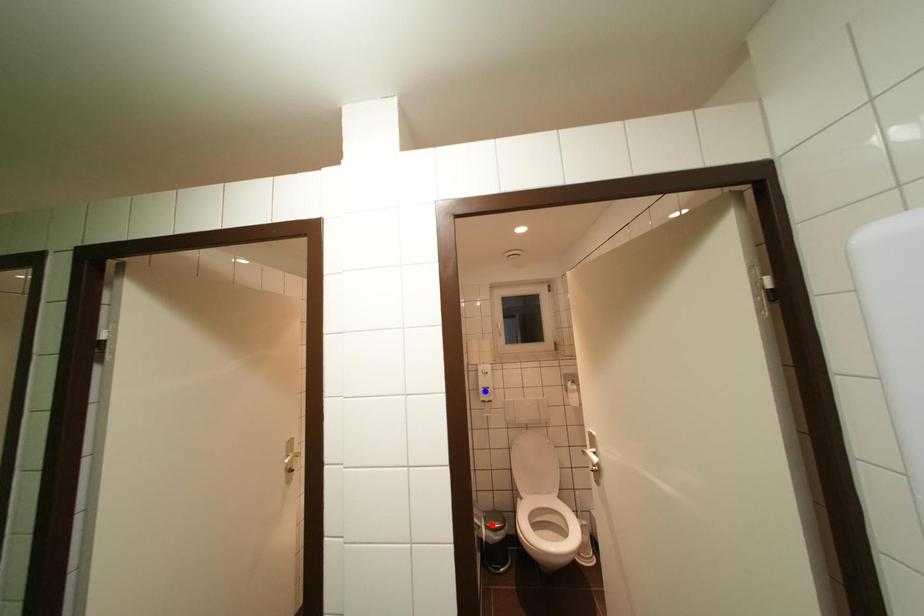
Question: In the image, two points are highlighted. Which point is nearer to the camera? Reply with the corresponding letter.

Choices:
 (A) blue point
 (B) red point

Answer: (B)